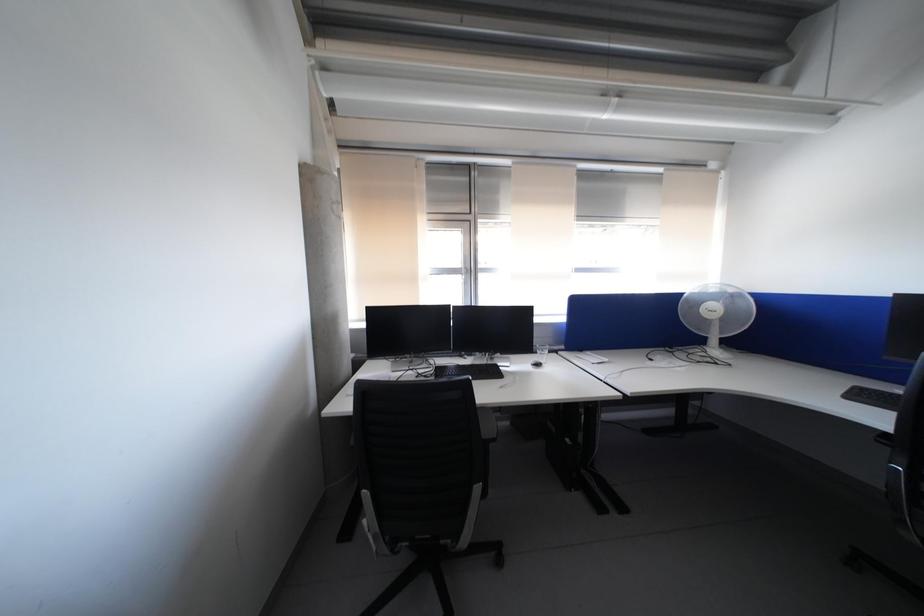
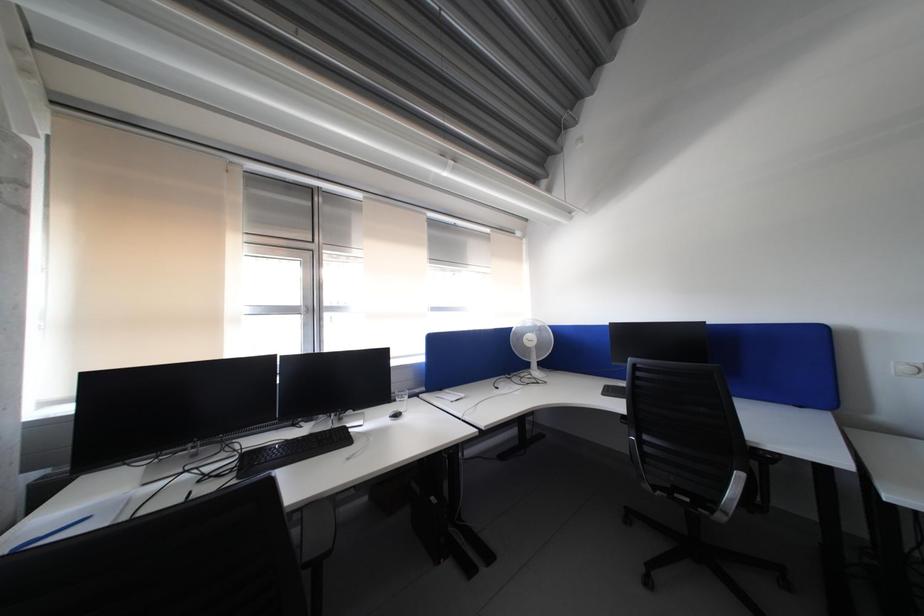
Question: Based on the continuous images, in which direction is the camera rotating? Reply with the corresponding letter.

Choices:
 (A) Left
 (B) Right
 (C) Up
 (D) Down

Answer: (B)